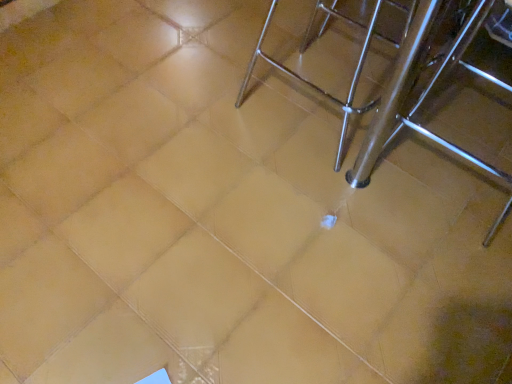
Locate an element on the screen. The height and width of the screenshot is (384, 512). free space in front of polished metal chair at upper right is located at coordinates (309, 199).